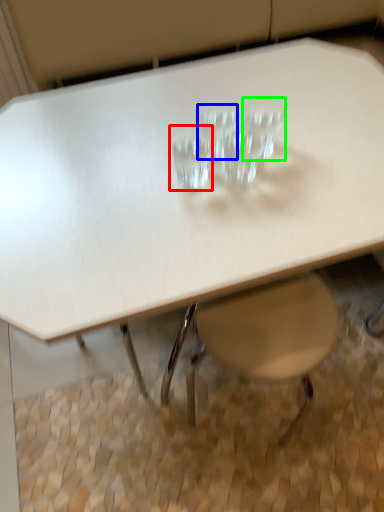
Question: Considering the real-world distances, which object is farthest from martini glass (highlighted by a red box)? martini glass (highlighted by a blue box) or martini glass (highlighted by a green box)?

Choices:
 (A) martini glass
 (B) martini glass

Answer: (B)